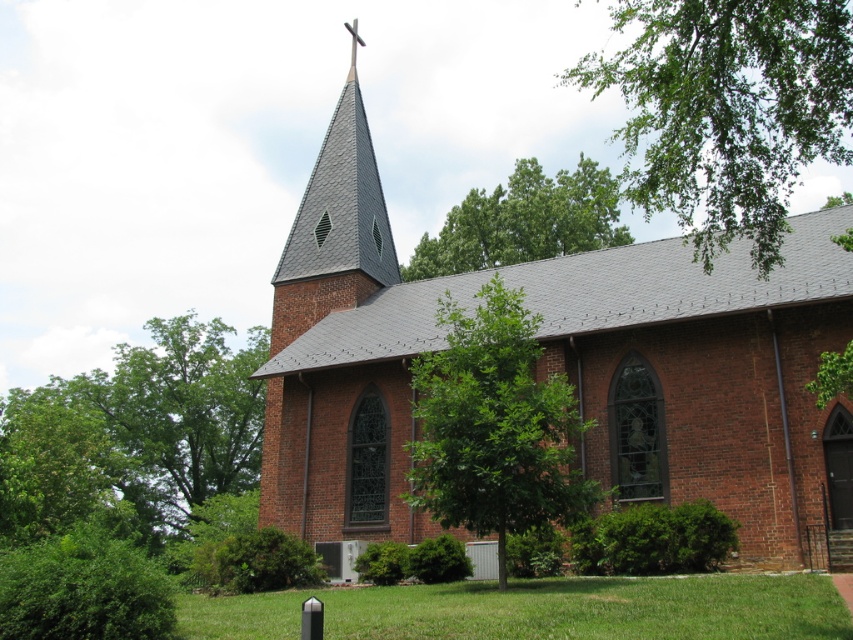
Does green leafy tree at lower left have a lesser height compared to gray slate spire at upper center?

Correct, green leafy tree at lower left is not as tall as gray slate spire at upper center.

At what (x,y) coordinates should I click in order to perform the action: click on green leafy tree at lower left. Please return your answer as a coordinate pair (x, y). The image size is (853, 640). Looking at the image, I should click on (54, 465).

What do you see at coordinates (54, 465) in the screenshot? I see `green leafy tree at lower left` at bounding box center [54, 465].

Image resolution: width=853 pixels, height=640 pixels. Find the location of `green leafy tree at lower left`. green leafy tree at lower left is located at coordinates (54, 465).

Measure the distance between green leafy tree at upper center and gray slate spire at upper center.

16.54 meters

Is green leafy tree at upper center positioned before gray slate spire at upper center?

Yes, green leafy tree at upper center is in front of gray slate spire at upper center.

Identify the location of green leafy tree at upper center. (524, 221).

Does red brick chapel at center have a greater height compared to green leafy tree at upper center?

Yes, red brick chapel at center is taller than green leafy tree at upper center.

Does red brick chapel at center have a lesser width compared to green leafy tree at upper center?

Indeed, red brick chapel at center has a lesser width compared to green leafy tree at upper center.

Who is more distant from viewer, (x=550, y=308) or (x=454, y=259)?

Positioned behind is point (x=454, y=259).

Find the location of a particular element. red brick chapel at center is located at coordinates (704, 372).